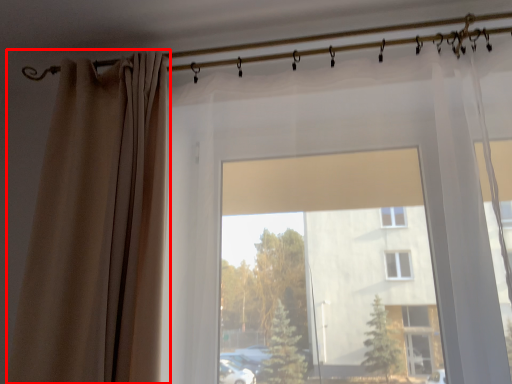
Question: Where is curtain (annotated by the red box) located in relation to clothesline in the image?

Choices:
 (A) left
 (B) right

Answer: (A)